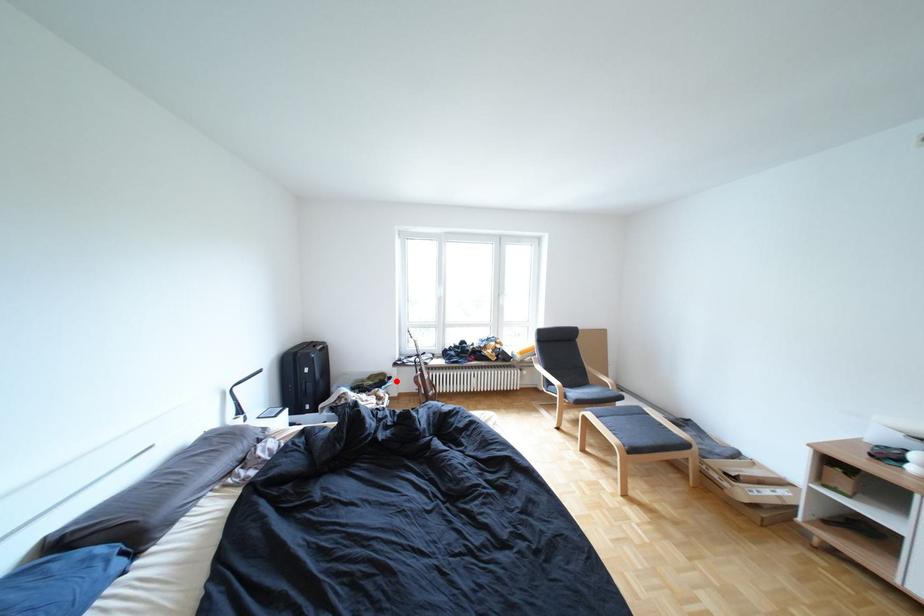
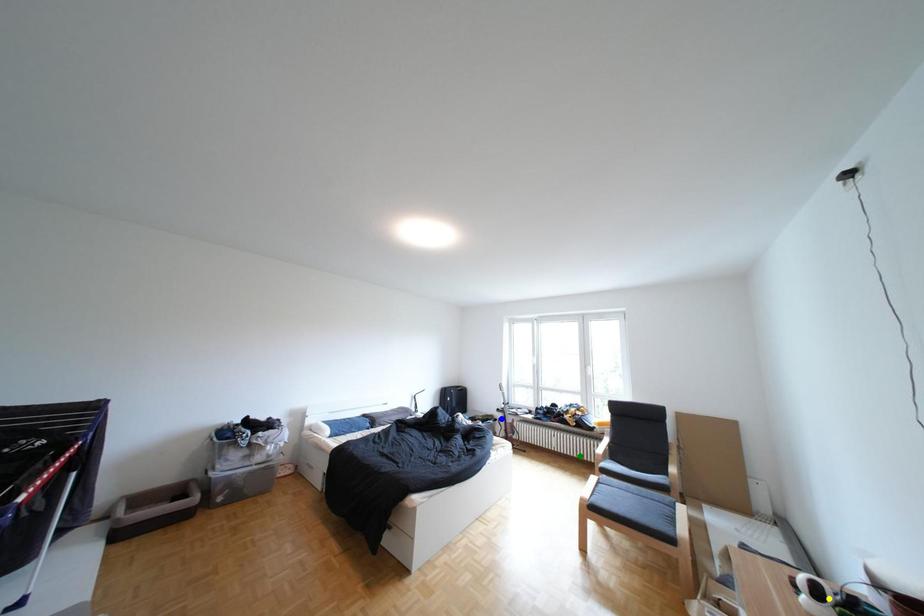
Question: I am providing you with two images of the same scene from different viewpoints. A red point is marked on the first image. You are given multiple points on the second image. In image 2, which mark is for the same physical point as the one in image 1?

Choices:
 (A) blue point
 (B) green point
 (C) yellow point

Answer: (A)